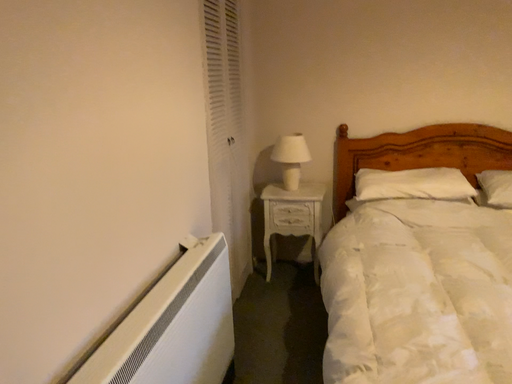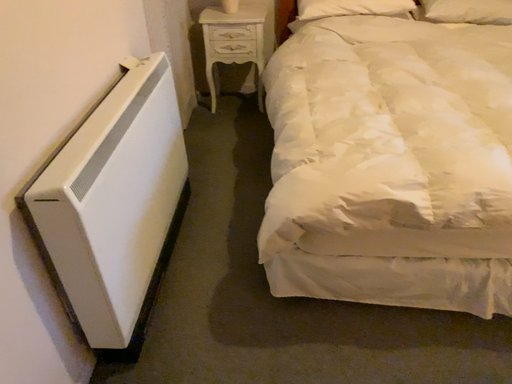
Question: How did the camera likely rotate when shooting the video?

Choices:
 (A) rotated upward
 (B) rotated downward

Answer: (B)